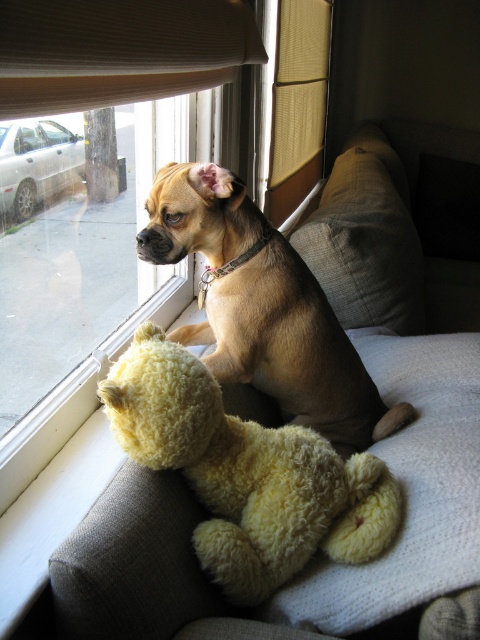
Who is shorter, light brown fur at center or clear glass window at upper left?

Standing shorter between the two is clear glass window at upper left.

Between point (237, 248) and point (151, 1), which one is positioned in front?

Point (151, 1) is in front.

Between point (248, 307) and point (7, 24), which one is positioned in front?

Point (7, 24)

Locate an element on the screen. The height and width of the screenshot is (640, 480). light brown fur at center is located at coordinates (263, 307).

Does yellow fuzzy teddy bear at lower center appear on the left side of clear glass window at upper left?

No, yellow fuzzy teddy bear at lower center is not to the left of clear glass window at upper left.

Can you confirm if yellow fuzzy teddy bear at lower center is taller than clear glass window at upper left?

Incorrect, yellow fuzzy teddy bear at lower center's height is not larger of clear glass window at upper left's.

Between point (222, 461) and point (153, 65), which one is positioned behind?

The point (153, 65) is behind.

Find the location of `yellow fuzzy teddy bear at lower center`. yellow fuzzy teddy bear at lower center is located at coordinates (247, 472).

Is soft beige couch at center closer to the viewer compared to yellow fuzzy teddy bear at lower center?

Yes.

Find the location of a particular element. soft beige couch at center is located at coordinates (402, 356).